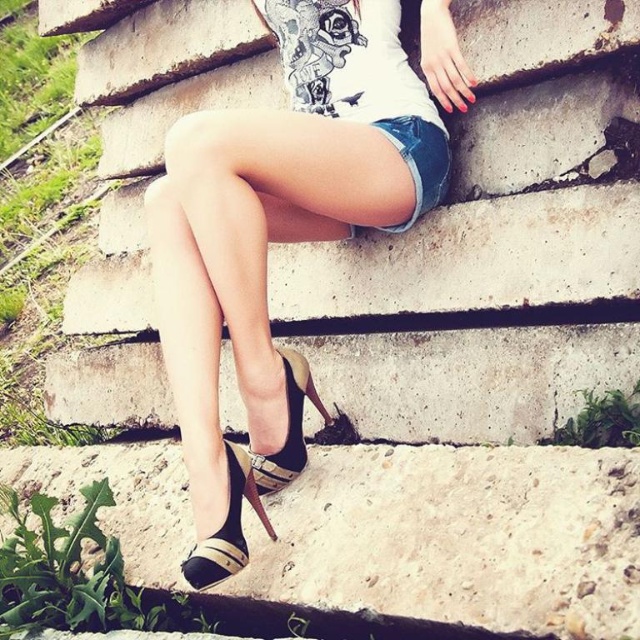
You are a fashion designer observing the image and need to recommend which shoe to pair with a tight dress. Considering the size difference between the leather high heels at center and the shiny gold sandal at center, which one would you suggest for a more dramatic look?

The leather high heels at center has a larger size compared to shiny gold sandal at center, so it would create a more dramatic look when paired with a tight dress.

You are a photographer trying to capture the shiny gold sandal at center and the leather high heels at center in a single shot. Since both are at center, which one will appear larger in the photo?

The leather high heels at center will appear larger in the photo because it is closer to the viewer than the shiny gold sandal at center.

You are a photographer setting up a shoot on the stairs. You want to place a prop on the step where the leather high heels at center and shiny gold sandal at center are located. If you want the prop to be between them, where should you place it?

You should place the prop between the leather high heels at center and the shiny gold sandal at center, as the leather high heels at center are to the left of the shiny gold sandal at center.